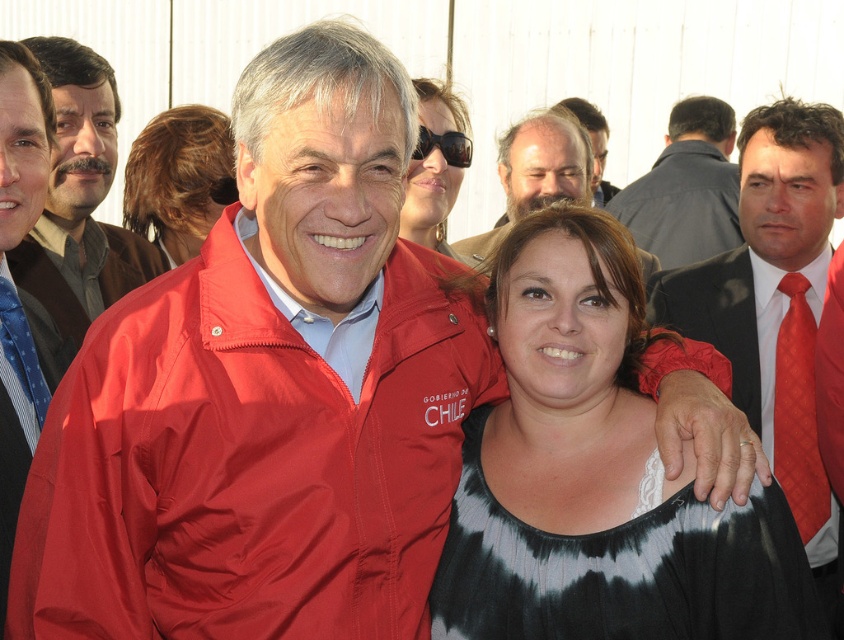
Can you confirm if matte nylon jacket at center is bigger than black tie-dye blouse at center?

Correct, matte nylon jacket at center is larger in size than black tie-dye blouse at center.

Is point (180, 614) in front of point (761, 572)?

Yes, point (180, 614) is closer to viewer.

I want to click on matte nylon jacket at center, so click(x=247, y=464).

Who is shorter, red textured tie at center or red textured tie at right?

red textured tie at right is shorter.

What do you see at coordinates (775, 307) in the screenshot? The width and height of the screenshot is (844, 640). I see `red textured tie at center` at bounding box center [775, 307].

What do you see at coordinates (775, 307) in the screenshot? Image resolution: width=844 pixels, height=640 pixels. I see `red textured tie at center` at bounding box center [775, 307].

You are a GUI agent. You are given a task and a screenshot of the screen. Output one action in this format:
    pyautogui.click(x=<x>, y=<y>)
    Task: Click on the red textured tie at center
    The width and height of the screenshot is (844, 640).
    Given the screenshot: What is the action you would take?
    click(775, 307)

From the picture: Which of these two, red textured tie at center or dark gray suit at center, stands shorter?

With less height is dark gray suit at center.

Which is in front, point (820, 504) or point (729, 244)?

Point (820, 504) is in front.

I want to click on red textured tie at center, so click(775, 307).